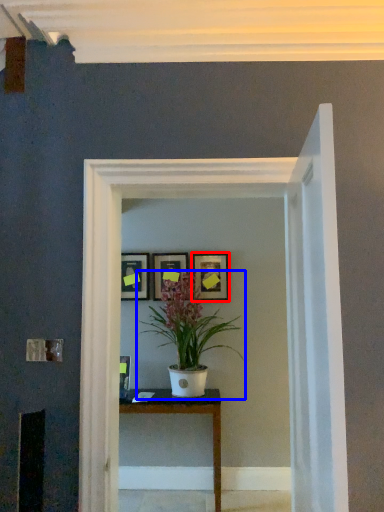
Question: Which of the following is the farthest to the observer, picture frame (highlighted by a red box) or houseplant (highlighted by a blue box)?

Choices:
 (A) picture frame
 (B) houseplant

Answer: (A)